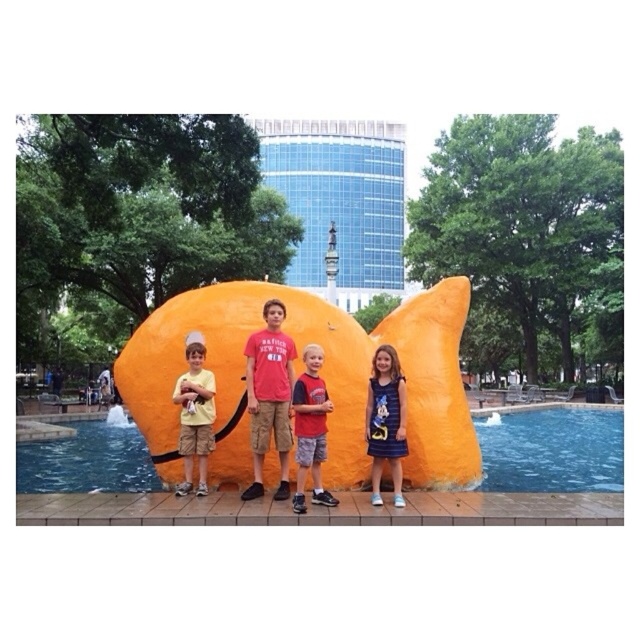
Between orange fabric fish at center and matte yellow shorts at center, which one is positioned lower?

→ matte yellow shorts at center is below.

You are a GUI agent. You are given a task and a screenshot of the screen. Output one action in this format:
    pyautogui.click(x=<x>, y=<y>)
    Task: Click on the orange fabric fish at center
    This screenshot has height=640, width=640.
    Given the screenshot: What is the action you would take?
    pyautogui.click(x=323, y=372)

The height and width of the screenshot is (640, 640). Find the location of `orange fabric fish at center`. orange fabric fish at center is located at coordinates (323, 372).

Can you confirm if blue denim dress at center is positioned to the right of red cotton shirt at center?

Indeed, blue denim dress at center is positioned on the right side of red cotton shirt at center.

Which of these two, blue denim dress at center or red cotton shirt at center, stands taller?

Standing taller between the two is blue denim dress at center.

Who is more distant from viewer, (384, 380) or (304, 442)?

Positioned behind is point (384, 380).

Identify the location of blue denim dress at center. The width and height of the screenshot is (640, 640). coord(385,420).

Which is behind, point (330, 333) or point (304, 492)?

Point (330, 333)

Where is `orange fabric fish at center`? Image resolution: width=640 pixels, height=640 pixels. orange fabric fish at center is located at coordinates (323, 372).